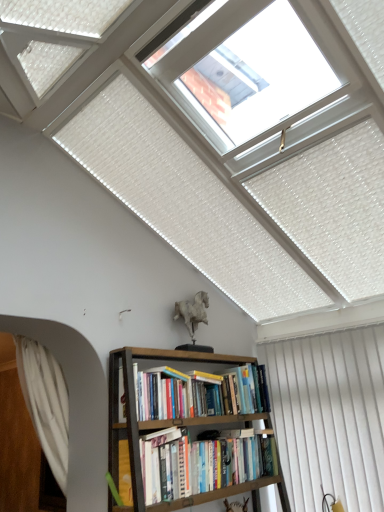
Question: From a real-world perspective, relative to white sheer curtain at left, marked as the 1th curtain in a left-to-right arrangement, is brown wooden bookcase at center vertically above or below?

Choices:
 (A) below
 (B) above

Answer: (A)

Question: Considering their positions, is brown wooden bookcase at center located in front of or behind white sheer curtain at left, positioned as the second curtain in right-to-left order?

Choices:
 (A) behind
 (B) front

Answer: (B)

Question: Which is farther from the hardcover books at center?

Choices:
 (A) white sheer curtain at left, marked as the 1th curtain in a left-to-right arrangement
 (B) white vertical blinds at right, the first curtain from the right
 (C) brown wooden bookcase at center
 (D) hardcover book at lower center
 (E) transparent glass skylight at upper center

Answer: (E)

Question: Considering the real-world distances, which object is farthest from the white sheer curtain at left, positioned as the second curtain in right-to-left order?

Choices:
 (A) transparent glass skylight at upper center
 (B) brown wooden bookcase at center
 (C) hardcover books at center
 (D) hardcover book at lower center
 (E) white vertical blinds at right, placed as the second curtain when sorted from left to right

Answer: (A)